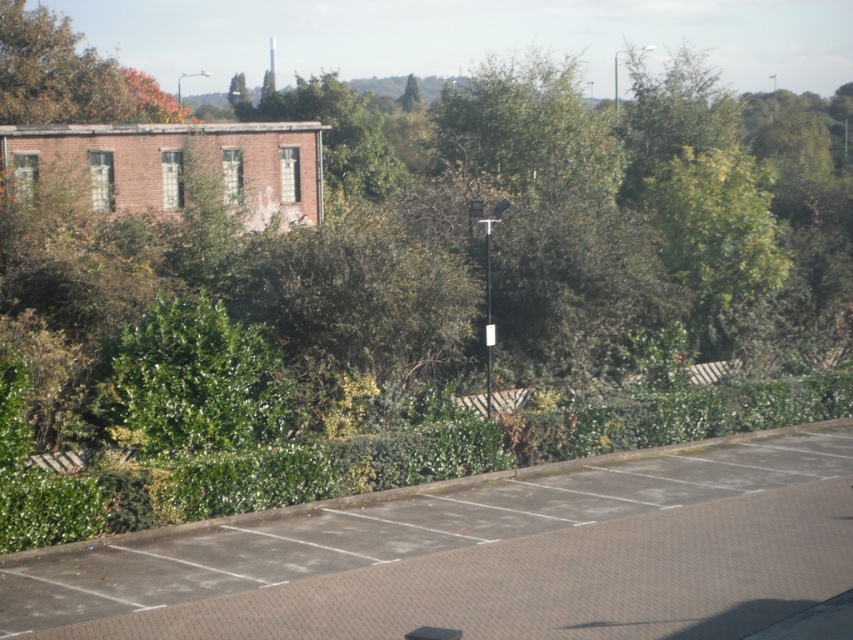
Question: Among these points, which one is farthest from the camera?

Choices:
 (A) (486, 305)
 (B) (405, 104)
 (C) (770, 477)

Answer: (B)

Question: Is the position of metallic pole at center more distant than that of green leafy tree at upper center?

Choices:
 (A) yes
 (B) no

Answer: (B)

Question: Which object is closer to the camera taking this photo?

Choices:
 (A) metallic pole at center
 (B) green leafy tree at upper center
 (C) brown textured pavement at lower center

Answer: (C)

Question: Which point is farther to the camera?

Choices:
 (A) click(x=410, y=81)
 (B) click(x=718, y=611)

Answer: (A)

Question: Can you confirm if brown textured pavement at lower center is positioned to the left of metallic pole at center?

Choices:
 (A) no
 (B) yes

Answer: (A)

Question: Can you confirm if brown textured pavement at lower center is wider than green leafy tree at upper center?

Choices:
 (A) no
 (B) yes

Answer: (B)